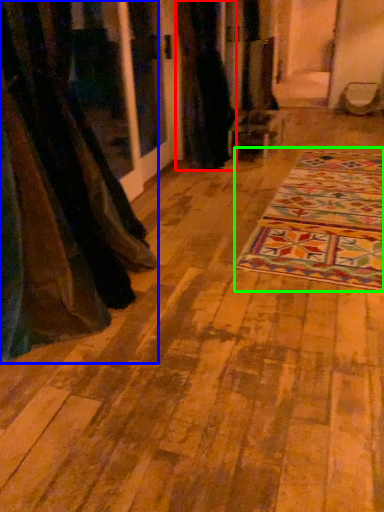
Question: Estimate the real-world distances between objects in this image. Which object is farther from curtain (highlighted by a red box), curtain (highlighted by a blue box) or mat (highlighted by a green box)?

Choices:
 (A) curtain
 (B) mat

Answer: (A)